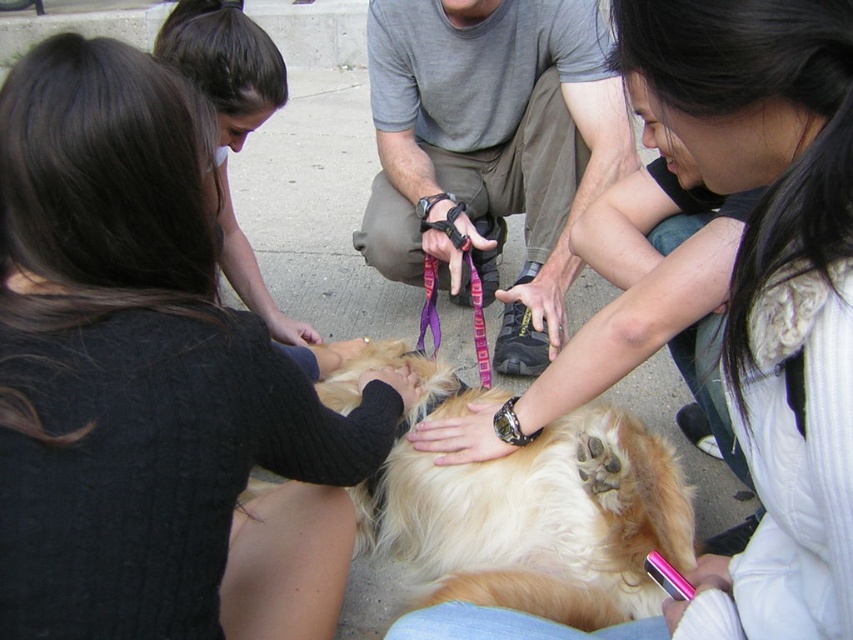
Question: Can you confirm if black sweater at center is positioned to the left of golden fur dog at center?

Choices:
 (A) yes
 (B) no

Answer: (A)

Question: Which of these objects is positioned farthest from the gray cotton shirt at center?

Choices:
 (A) black sweater at center
 (B) smooth brown hair at upper left
 (C) fluffy golden fur at center
 (D) golden fur dog at center

Answer: (C)

Question: Does fluffy golden fur at center appear under gray cotton shirt at center?

Choices:
 (A) no
 (B) yes

Answer: (B)

Question: Which point is farther to the camera?

Choices:
 (A) click(x=618, y=432)
 (B) click(x=44, y=432)
 (C) click(x=496, y=100)
 (D) click(x=268, y=72)

Answer: (C)

Question: Is gray cotton shirt at center positioned in front of smooth brown hair at upper left?

Choices:
 (A) yes
 (B) no

Answer: (B)

Question: Among these points, which one is farthest from the camera?

Choices:
 (A) (289, 500)
 (B) (579, 8)
 (C) (207, 4)

Answer: (B)